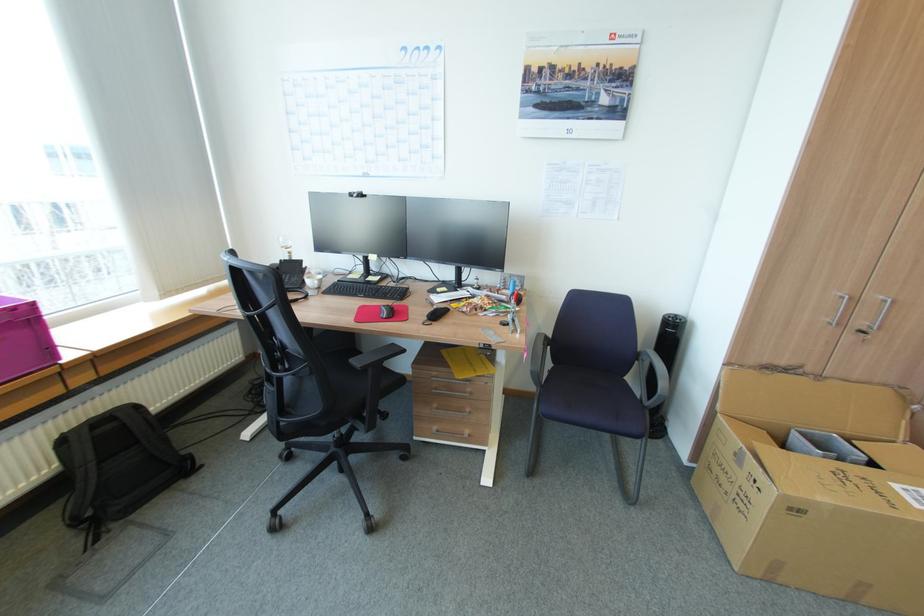
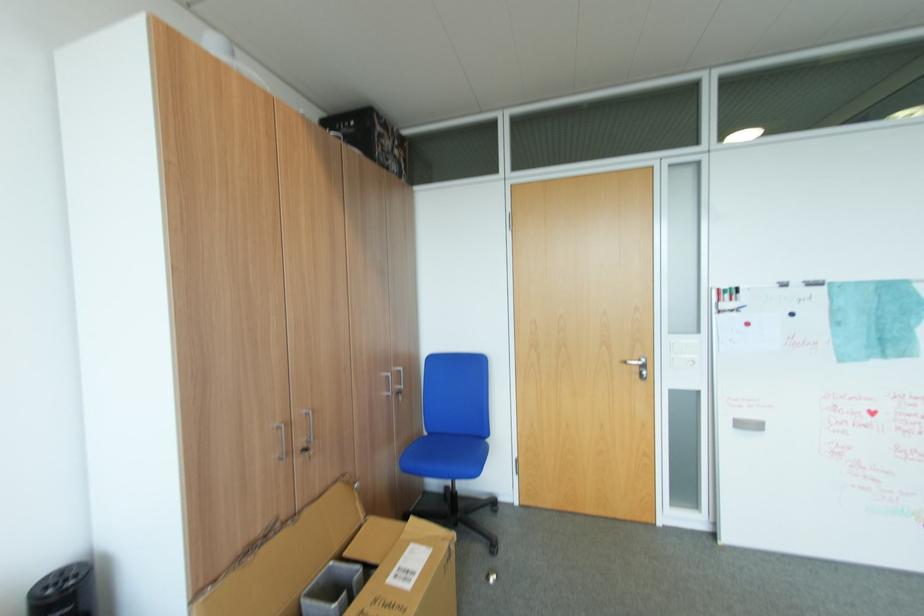
Where in the second image is the point corresponding to (x=847, y=297) from the first image?

(283, 430)